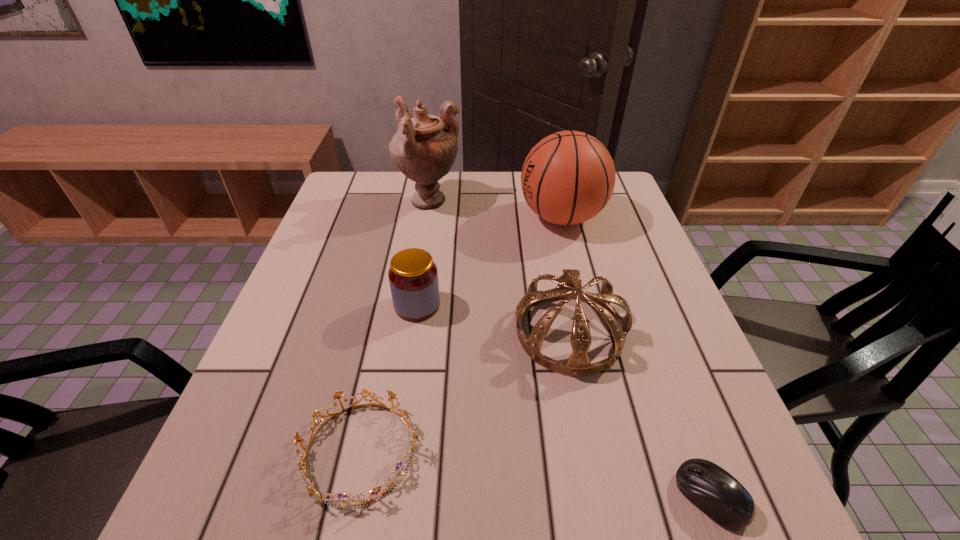
Where is `free spot located 0.400m on the surface of the second tallest object near the brand logo`? free spot located 0.400m on the surface of the second tallest object near the brand logo is located at coordinates (375, 217).

Where is `vacant space located 0.330m on the surface of the second tallest object near the brand logo`? This screenshot has height=540, width=960. vacant space located 0.330m on the surface of the second tallest object near the brand logo is located at coordinates (x=400, y=217).

Where is `free region located 0.220m on the front of the third tallest object`? free region located 0.220m on the front of the third tallest object is located at coordinates (603, 501).

Where is `free space located on the left of the fourth tallest object`? The height and width of the screenshot is (540, 960). free space located on the left of the fourth tallest object is located at coordinates (349, 306).

Identify the location of free location located 0.180m on the front-facing side of the left tiara. The width and height of the screenshot is (960, 540). (528, 451).

I want to click on free space located 0.310m on the left of the shortest object, so click(474, 496).

Identify the location of urn located in the far edge section of the desktop. (424, 148).

At what (x,y) coordinates should I click in order to perform the action: click on basketball at the far edge. Please return your answer as a coordinate pair (x, y). The width and height of the screenshot is (960, 540). Looking at the image, I should click on (567, 178).

What are the coordinates of `tiara at the near edge` in the screenshot? It's located at (413, 435).

At what (x,y) coordinates should I click in order to perform the action: click on mouse situated at the near edge. Please return your answer as a coordinate pair (x, y). Looking at the image, I should click on (713, 490).